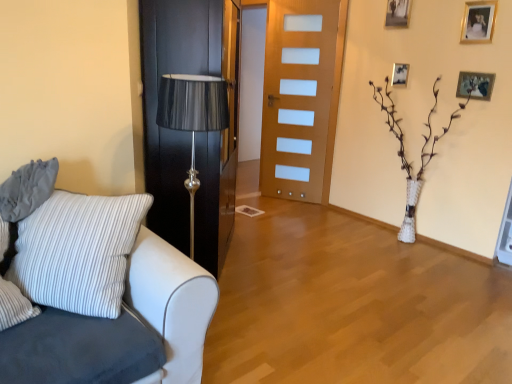
Question: Does gold metallic picture frame at upper right, acting as the third picture frame starting from the left, come behind white fabric couch at left?

Choices:
 (A) yes
 (B) no

Answer: (A)

Question: Is white fabric couch at left at the back of gold metallic picture frame at upper right, the second picture frame from the right?

Choices:
 (A) no
 (B) yes

Answer: (A)

Question: Is gold metallic picture frame at upper right, the second picture frame from the right, to the left of white fabric couch at left from the viewer's perspective?

Choices:
 (A) yes
 (B) no

Answer: (B)

Question: From the image's perspective, is gold metallic picture frame at upper right, the second picture frame from the right, located beneath white fabric couch at left?

Choices:
 (A) yes
 (B) no

Answer: (B)

Question: From a real-world perspective, is gold metallic picture frame at upper right, acting as the third picture frame starting from the left, physically above white fabric couch at left?

Choices:
 (A) no
 (B) yes

Answer: (B)

Question: In terms of size, does wooden door at center, positioned as the 2th door in front-to-back order, appear bigger or smaller than white textured vase at center right?

Choices:
 (A) small
 (B) big

Answer: (A)

Question: Based on their positions, is wooden door at center, the first door in the back-to-front sequence, located to the left or right of white textured vase at center right?

Choices:
 (A) right
 (B) left

Answer: (B)

Question: Relative to white textured vase at center right, is wooden door at center, the first door in the back-to-front sequence, in front or behind?

Choices:
 (A) front
 (B) behind

Answer: (B)

Question: Is wooden door at center, the first door in the back-to-front sequence, inside the boundaries of white textured vase at center right, or outside?

Choices:
 (A) outside
 (B) inside

Answer: (A)

Question: From the image's perspective, is white fabric couch at left located above or below wooden door at center, the first door in the back-to-front sequence?

Choices:
 (A) below
 (B) above

Answer: (A)

Question: Is white fabric couch at left situated inside wooden door at center, the first door in the back-to-front sequence, or outside?

Choices:
 (A) inside
 (B) outside

Answer: (B)

Question: Looking at the image, does white fabric couch at left seem bigger or smaller compared to wooden door at center, which is counted as the second door, starting from the left?

Choices:
 (A) small
 (B) big

Answer: (B)

Question: From their relative heights in the image, would you say white fabric couch at left is taller or shorter than wooden door at center, positioned as the 2th door in front-to-back order?

Choices:
 (A) tall
 (B) short

Answer: (B)

Question: Is white fabric couch at left inside the boundaries of gray fabric pillow at left, or outside?

Choices:
 (A) inside
 (B) outside

Answer: (B)

Question: Considering the positions of white fabric couch at left and gray fabric pillow at left in the image, is white fabric couch at left taller or shorter than gray fabric pillow at left?

Choices:
 (A) short
 (B) tall

Answer: (B)